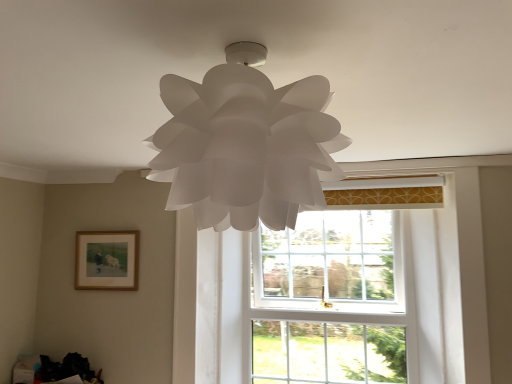
Question: Is point (428, 254) positioned closer to the camera than point (272, 208)?

Choices:
 (A) closer
 (B) farther

Answer: (B)

Question: From the image's perspective, is white glass window at center located above or below white paper lamp at center?

Choices:
 (A) above
 (B) below

Answer: (B)

Question: Which of these objects is positioned farthest from the white paper lamp at center?

Choices:
 (A) wooden framed painting at lower left
 (B) white glass window at center

Answer: (A)

Question: Which of these objects is positioned closest to the white glass window at center?

Choices:
 (A) white paper lamp at center
 (B) wooden framed painting at lower left

Answer: (B)